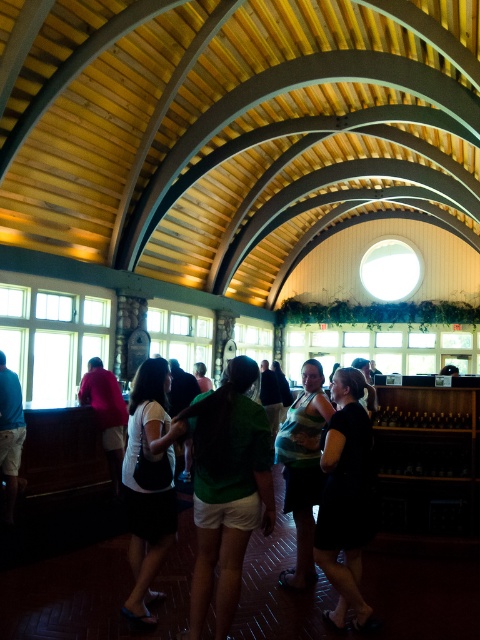
Question: Is green fabric shirt at center further to camera compared to blue shirt at left?

Choices:
 (A) no
 (B) yes

Answer: (A)

Question: Is white matte shirt at center closer to the viewer compared to blue shirt at left?

Choices:
 (A) no
 (B) yes

Answer: (B)

Question: Considering the real-world distances, which object is farthest from the matte pink shirt at center?

Choices:
 (A) white matte shirt at center
 (B) black matte dress at center

Answer: (B)

Question: Which object is the closest to the black matte dress at center?

Choices:
 (A) blue shirt at left
 (B) white matte shirt at center
 (C) green fabric shirt at center

Answer: (C)

Question: Estimate the real-world distances between objects in this image. Which object is farther from the white matte shirt at center?

Choices:
 (A) green fabric shirt at center
 (B) blue shirt at left
 (C) matte pink shirt at center
 (D) black matte dress at center

Answer: (C)

Question: Is green fabric shirt at center wider than white matte shirt at center?

Choices:
 (A) yes
 (B) no

Answer: (A)